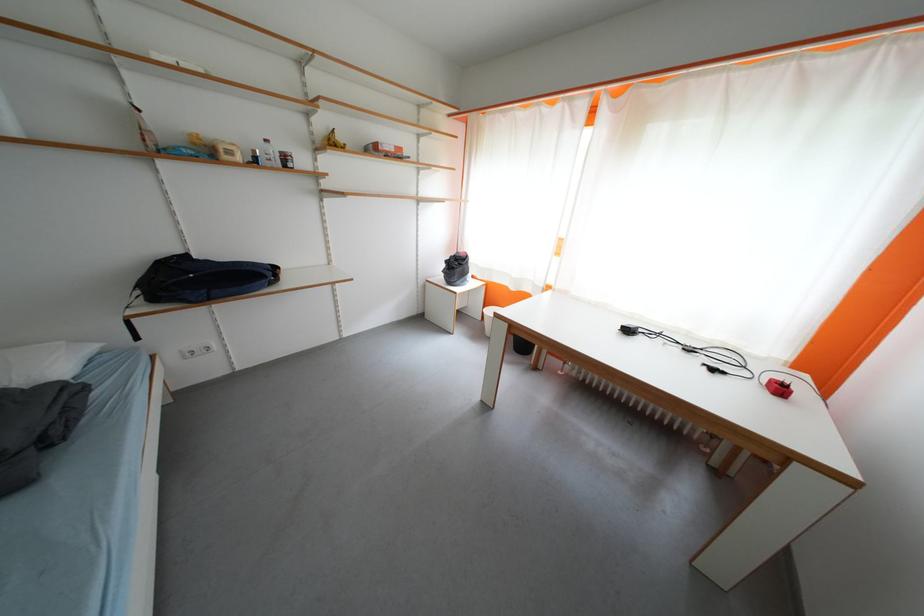
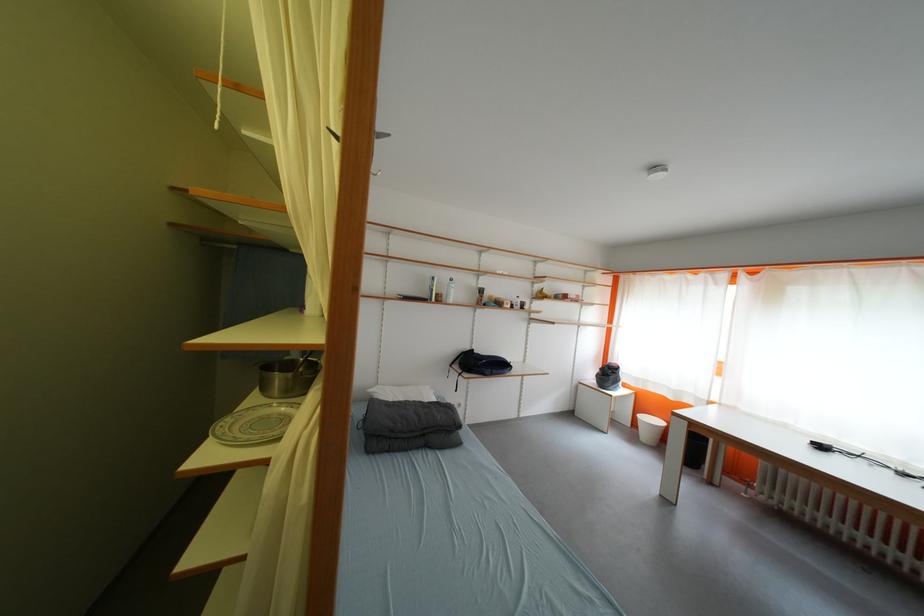
Find the pixel in the second image that matches point (455, 265) in the first image.

(610, 371)